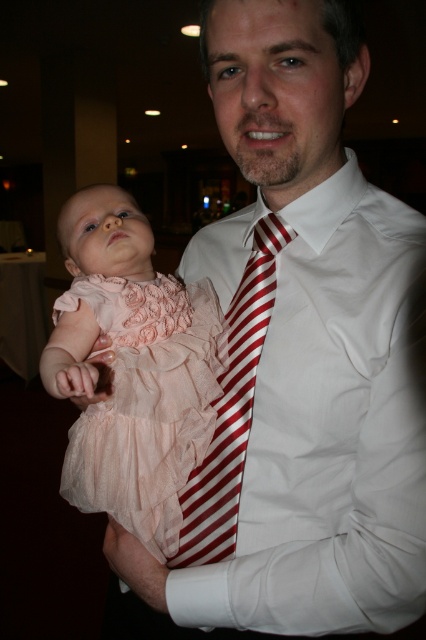
Question: Observing the image, what is the correct spatial positioning of pale pink chiffon dress at center in reference to red striped tie at center?

Choices:
 (A) left
 (B) right

Answer: (A)

Question: Is pale pink chiffon dress at center to the left of pink satin dress at left from the viewer's perspective?

Choices:
 (A) yes
 (B) no

Answer: (B)

Question: Does pale pink chiffon dress at center have a greater width compared to pink satin dress at left?

Choices:
 (A) yes
 (B) no

Answer: (A)

Question: Which point is farther from the camera taking this photo?

Choices:
 (A) (250, 259)
 (B) (172, 403)
 (C) (75, 385)

Answer: (A)

Question: Which object is closer to the camera taking this photo?

Choices:
 (A) pink satin dress at left
 (B) pale pink chiffon dress at center
 (C) red striped tie at center

Answer: (A)

Question: Which object is farther from the camera taking this photo?

Choices:
 (A) red striped tie at center
 (B) pale pink chiffon dress at center
 (C) pink satin dress at left

Answer: (A)